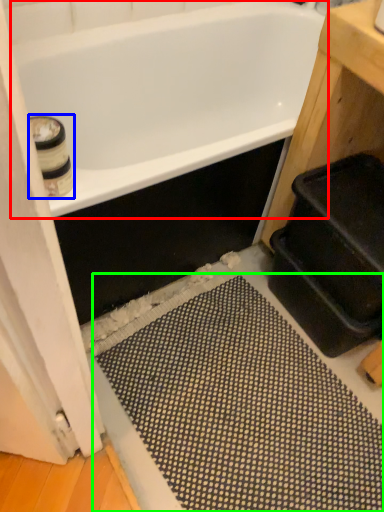
Question: Which object is positioned farthest from bathtub (highlighted by a red box)? Select from toilet paper (highlighted by a blue box) and bath mat (highlighted by a green box).

Choices:
 (A) toilet paper
 (B) bath mat

Answer: (B)